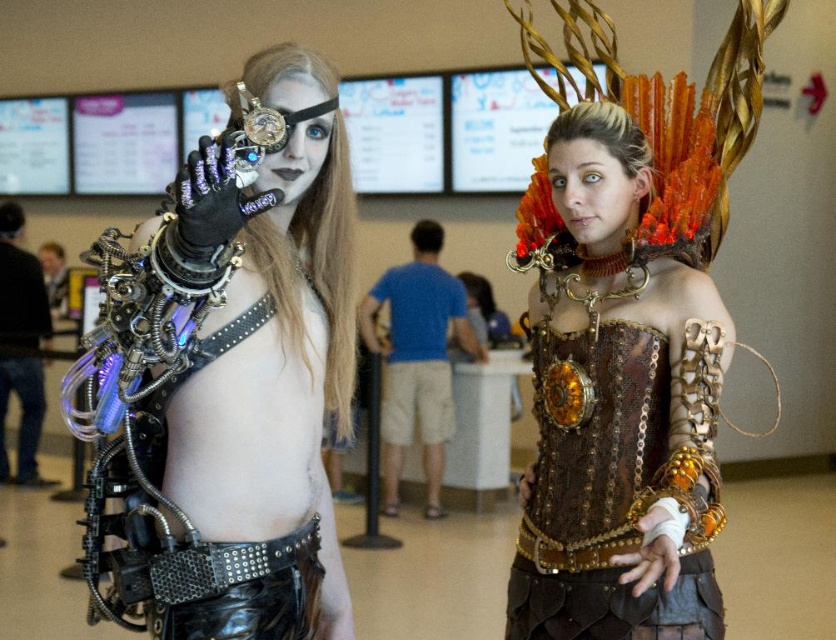
Based on the photo, who is more distant from viewer, [584,170] or [296,196]?

The point [584,170] is more distant.

Locate an element on the screen. The width and height of the screenshot is (836, 640). matte gold face at center is located at coordinates (594, 193).

Between point (720, 600) and point (293, 422), which one is positioned behind?

The point (720, 600) is more distant.

Between brown leather corset at center and steampunk armor at center, which one is positioned higher?

steampunk armor at center

Is point (709, 500) positioned before point (320, 83)?

That is True.

Where is `brown leather corset at center`? The height and width of the screenshot is (640, 836). brown leather corset at center is located at coordinates (618, 408).

Which is in front, point (14, 244) or point (599, 180)?

Positioned in front is point (599, 180).

Describe the element at coordinates (19, 285) in the screenshot. This screenshot has width=836, height=640. I see `brushed metal water gun at left` at that location.

The height and width of the screenshot is (640, 836). I want to click on brushed metal water gun at left, so click(19, 285).